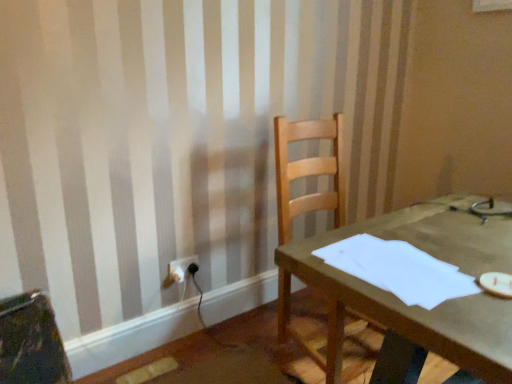
Question: From their relative heights in the image, would you say wooden chair at center is taller or shorter than white plastic electric outlet at lower left?

Choices:
 (A) short
 (B) tall

Answer: (B)

Question: In terms of size, does wooden chair at center appear bigger or smaller than white plastic electric outlet at lower left?

Choices:
 (A) small
 (B) big

Answer: (B)

Question: Which object is positioned farthest from the white paper at center?

Choices:
 (A) wooden chair at center
 (B) white plastic electric outlet at lower left

Answer: (B)

Question: Estimate the real-world distances between objects in this image. Which object is farther from the wooden chair at center?

Choices:
 (A) white plastic electric outlet at lower left
 (B) white paper at center

Answer: (A)